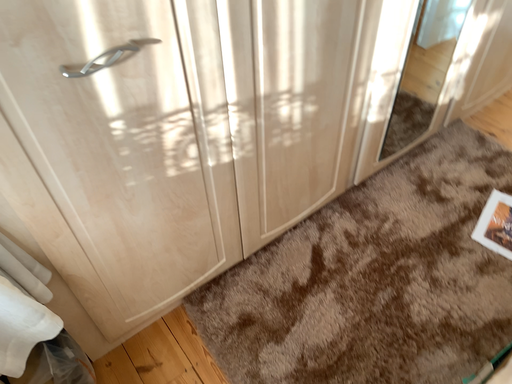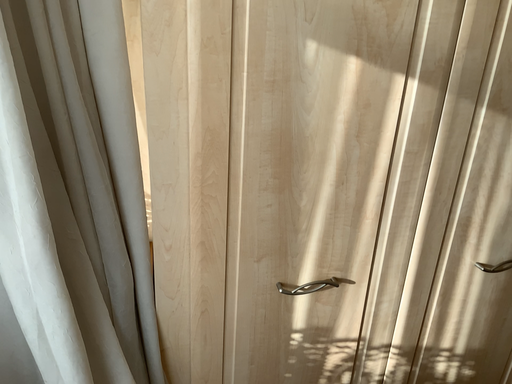
Question: Which way did the camera rotate in the video?

Choices:
 (A) rotated right
 (B) rotated left

Answer: (B)